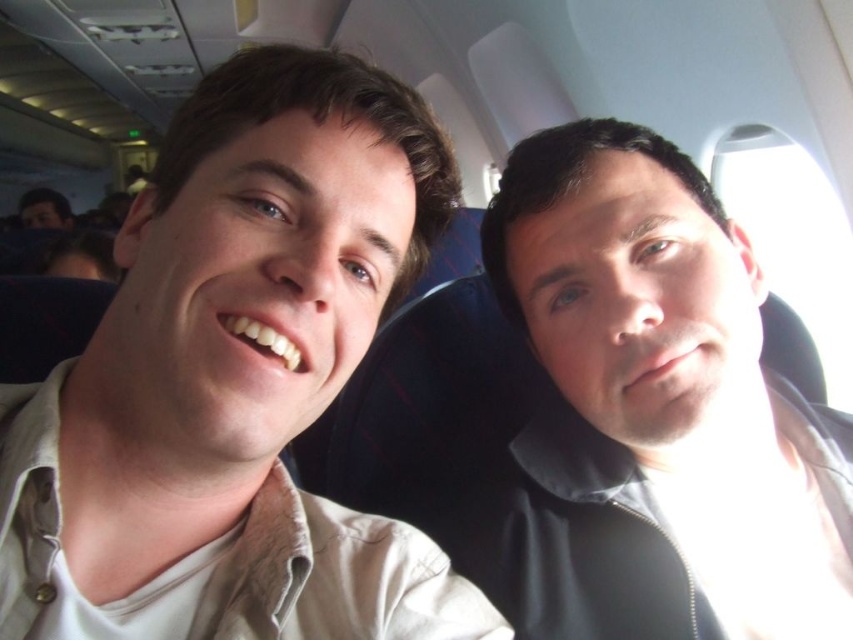
Question: In this image, where is light beige shirt at left located relative to matte black jacket at right?

Choices:
 (A) left
 (B) right

Answer: (A)

Question: Which object appears farthest from the camera in this image?

Choices:
 (A) matte black face at left
 (B) matte black jacket at right
 (C) light beige shirt at left

Answer: (A)

Question: Which point is closer to the camera taking this photo?

Choices:
 (A) (67, 205)
 (B) (680, 403)
 (C) (164, 330)

Answer: (C)

Question: Which object is positioned farthest from the matte black face at left?

Choices:
 (A) matte black jacket at right
 (B) light beige shirt at left

Answer: (A)

Question: Does light beige shirt at left appear under matte black jacket at right?

Choices:
 (A) yes
 (B) no

Answer: (B)

Question: Is the position of matte black jacket at right more distant than that of matte black face at left?

Choices:
 (A) no
 (B) yes

Answer: (A)